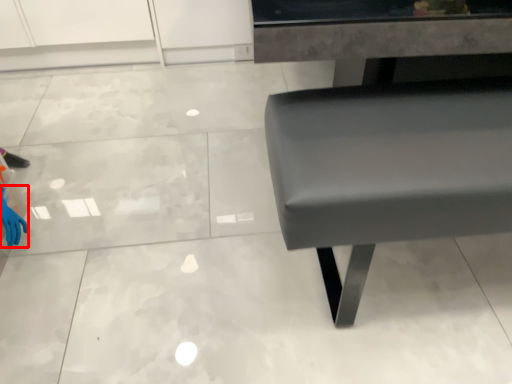
Question: From the image's perspective, where is hand (annotated by the red box) located relative to furniture?

Choices:
 (A) below
 (B) above

Answer: (A)